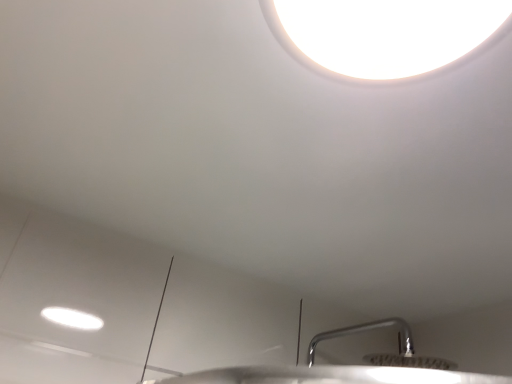
Measure the distance between white glossy lamp at upper center and camera.

white glossy lamp at upper center and camera are 17.83 inches apart from each other.

This screenshot has height=384, width=512. I want to click on white glossy lamp at upper center, so click(x=385, y=34).

What do you see at coordinates (385, 34) in the screenshot? I see `white glossy lamp at upper center` at bounding box center [385, 34].

Where is `white glossy lamp at upper center`? white glossy lamp at upper center is located at coordinates (385, 34).